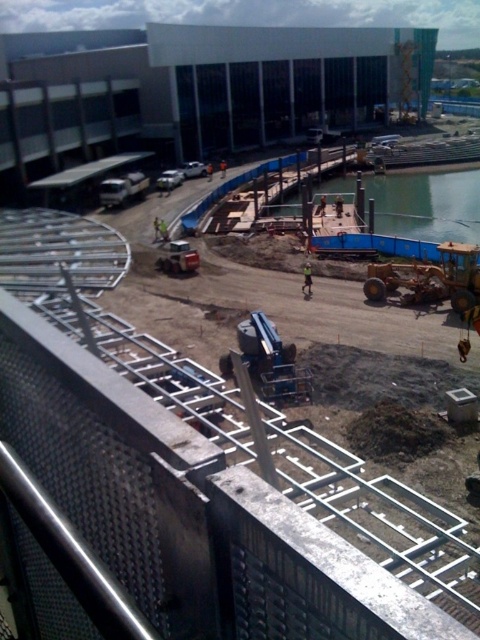
Does yellow rubber tractor at lower right have a greater width compared to metallic blue truck at center?

Correct, the width of yellow rubber tractor at lower right exceeds that of metallic blue truck at center.

Where is `yellow rubber tractor at lower right`? Image resolution: width=480 pixels, height=640 pixels. yellow rubber tractor at lower right is located at coordinates [430, 278].

Between yellow rubber tractor at lower right and green reflective safety vest at center, which one has more height?

yellow rubber tractor at lower right

Which is in front, point (388, 264) or point (304, 264)?

Point (388, 264)

This screenshot has width=480, height=640. Identify the location of yellow rubber tractor at lower right. (430, 278).

The width and height of the screenshot is (480, 640). In order to click on yellow rubber tractor at lower right in this screenshot , I will do `click(430, 278)`.

Identify the location of metallic blue truck at center. The width and height of the screenshot is (480, 640). (179, 259).

In order to click on metallic blue truck at center in this screenshot , I will do `click(179, 259)`.